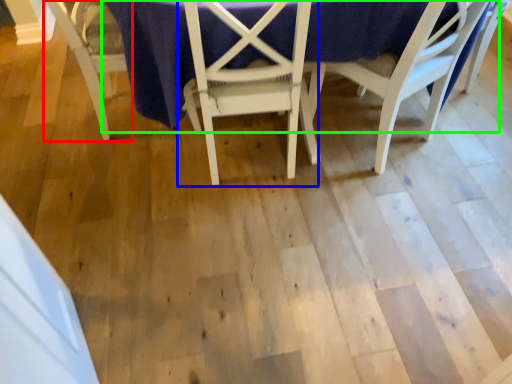
Question: Considering the real-world distances, which object is closest to chair (highlighted by a red box)? chair (highlighted by a blue box) or table (highlighted by a green box).

Choices:
 (A) chair
 (B) table

Answer: (B)